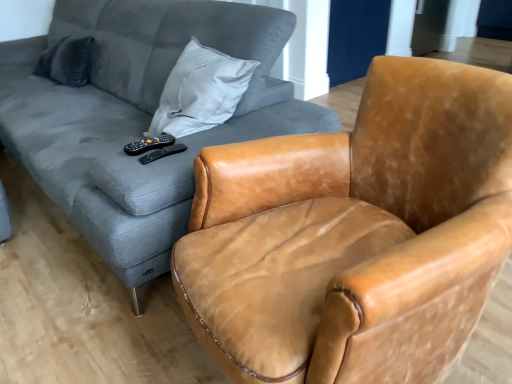
What is the approximate width of black matte remote at center, the 2th remote when ordered from left to right?

It is 13.40 centimeters.

This screenshot has height=384, width=512. What do you see at coordinates (138, 117) in the screenshot?
I see `matte gray fabric couch at upper left` at bounding box center [138, 117].

Describe the element at coordinates (67, 61) in the screenshot. Image resolution: width=512 pixels, height=384 pixels. I see `dark gray fabric pillow at upper left` at that location.

Where is `black matte remote at center, which is the 1th remote from right to left`? This screenshot has width=512, height=384. black matte remote at center, which is the 1th remote from right to left is located at coordinates (163, 153).

Based on their sizes in the image, would you say black matte remote at center, which is the 1th remote from right to left, is bigger or smaller than matte gray fabric couch at upper left?

Clearly, black matte remote at center, which is the 1th remote from right to left, is smaller in size than matte gray fabric couch at upper left.

Which of these two, black matte remote at center, the 2th remote when ordered from left to right, or matte gray fabric couch at upper left, is wider?

Wider between the two is matte gray fabric couch at upper left.

Can you confirm if black matte remote at center, which is the 1th remote from right to left, is positioned to the left of matte gray fabric couch at upper left?

Incorrect, black matte remote at center, which is the 1th remote from right to left, is not on the left side of matte gray fabric couch at upper left.

Which point is more forward, (x=178, y=148) or (x=176, y=17)?

The point (x=178, y=148) is in front.

Could you measure the distance between dark gray fabric pillow at upper left and black matte remote at center, the 2th remote when ordered from left to right?

1.58 meters.

Where is `pillow above the black matte remote at center, the 2th remote when ordered from left to right (from the image's perspective)`? pillow above the black matte remote at center, the 2th remote when ordered from left to right (from the image's perspective) is located at coordinates coord(67,61).

Is dark gray fabric pillow at upper left with black matte remote at center, which is the 1th remote from right to left?

No, dark gray fabric pillow at upper left is not next to black matte remote at center, which is the 1th remote from right to left.

Who is taller, dark gray fabric pillow at upper left or black matte remote at center, which is the 1th remote from right to left?

dark gray fabric pillow at upper left is taller.

Is leather armchair at center wider or thinner than black matte remote at center, the 2th remote when ordered from left to right?

Answer: In the image, leather armchair at center appears to be wider than black matte remote at center, the 2th remote when ordered from left to right.

Can you confirm if leather armchair at center is bigger than black matte remote at center, which is the 1th remote from right to left?

Correct, leather armchair at center is larger in size than black matte remote at center, which is the 1th remote from right to left.

Is leather armchair at center facing towards black matte remote at center, the 2th remote when ordered from left to right?

No, leather armchair at center is not turned towards black matte remote at center, the 2th remote when ordered from left to right.

From the image's perspective, which object appears higher, leather armchair at center or black matte remote at center, the 2th remote when ordered from left to right?

black matte remote at center, the 2th remote when ordered from left to right, from the image's perspective.

Between leather armchair at center and dark gray fabric pillow at upper left, which one has larger size?

With larger size is leather armchair at center.

Considering the sizes of objects leather armchair at center and dark gray fabric pillow at upper left in the image provided, who is thinner, leather armchair at center or dark gray fabric pillow at upper left?

With smaller width is dark gray fabric pillow at upper left.

Is leather armchair at center taller or shorter than dark gray fabric pillow at upper left?

Clearly, leather armchair at center is taller compared to dark gray fabric pillow at upper left.

Is dark gray fabric pillow at upper left surrounded by leather armchair at center?

That's incorrect, dark gray fabric pillow at upper left is not inside leather armchair at center.

Is matte gray fabric couch at upper left surrounded by dark gray fabric pillow at upper left?

No, dark gray fabric pillow at upper left does not contain matte gray fabric couch at upper left.

Based on their sizes in the image, would you say dark gray fabric pillow at upper left is bigger or smaller than matte gray fabric couch at upper left?

dark gray fabric pillow at upper left is smaller than matte gray fabric couch at upper left.

You are a GUI agent. You are given a task and a screenshot of the screen. Output one action in this format:
    pyautogui.click(x=<x>, y=<y>)
    Task: Click on the studio couch below the dark gray fabric pillow at upper left (from the image's perspective)
    
    Given the screenshot: What is the action you would take?
    pyautogui.click(x=138, y=117)

Based on their sizes in the image, would you say matte gray fabric couch at upper left is bigger or smaller than dark gray fabric pillow at upper left?

matte gray fabric couch at upper left is bigger than dark gray fabric pillow at upper left.

Considering the relative sizes of matte gray fabric couch at upper left and dark gray fabric pillow at upper left in the image provided, is matte gray fabric couch at upper left wider than dark gray fabric pillow at upper left?

Yes, matte gray fabric couch at upper left is wider than dark gray fabric pillow at upper left.

Measure the distance from matte gray fabric couch at upper left to dark gray fabric pillow at upper left.

The distance of matte gray fabric couch at upper left from dark gray fabric pillow at upper left is 24.37 inches.

The image size is (512, 384). In the image, there is a dark gray fabric pillow at upper left. Find the location of `studio couch below it (from the image's perspective)`. studio couch below it (from the image's perspective) is located at coordinates (138, 117).

Is leather armchair at center at the back of matte gray fabric couch at upper left?

No.

From the picture: Considering the positions of objects matte gray fabric couch at upper left and leather armchair at center in the image provided, who is more to the right, matte gray fabric couch at upper left or leather armchair at center?

Positioned to the right is leather armchair at center.

Does point (261, 75) lie in front of point (366, 184)?

No, it is not.

From the picture: From the image's perspective, which one is positioned higher, matte gray fabric couch at upper left or leather armchair at center?

From the image's view, matte gray fabric couch at upper left is above.

Where is `the 2nd remote counting from the right of the matte gray fabric couch at upper left`? The height and width of the screenshot is (384, 512). the 2nd remote counting from the right of the matte gray fabric couch at upper left is located at coordinates (163, 153).

In the image, there is a black matte remote at center, the 2th remote when ordered from left to right. What are the coordinates of `pillow above it (from the image's perspective)` in the screenshot? It's located at (67, 61).

When comparing their distances from black plastic remote at center, which is the second remote from right to left, does leather armchair at center or matte gray fabric couch at upper left seem further?

Among the two, matte gray fabric couch at upper left is located further to black plastic remote at center, which is the second remote from right to left.

Which object lies further to the anchor point black matte remote at center, which is the 1th remote from right to left, matte gray fabric couch at upper left or dark gray fabric pillow at upper left?

dark gray fabric pillow at upper left lies further to black matte remote at center, which is the 1th remote from right to left, than the other object.

Which object lies further to the anchor point matte gray fabric couch at upper left, dark gray fabric pillow at upper left or black plastic remote at center, marked as the 1th remote in a left-to-right arrangement?

black plastic remote at center, marked as the 1th remote in a left-to-right arrangement, is positioned further to the anchor matte gray fabric couch at upper left.

In the scene shown: Considering their positions, is black plastic remote at center, which is the second remote from right to left, positioned closer to matte gray fabric couch at upper left than leather armchair at center?

leather armchair at center lies closer to matte gray fabric couch at upper left than the other object.

Looking at the image, which one is located closer to dark gray fabric pillow at upper left, matte gray fabric couch at upper left or black matte remote at center, the 2th remote when ordered from left to right?

matte gray fabric couch at upper left is closer to dark gray fabric pillow at upper left.

Looking at the image, which one is located closer to leather armchair at center, dark gray fabric pillow at upper left or black matte remote at center, which is the 1th remote from right to left?

The object closer to leather armchair at center is black matte remote at center, which is the 1th remote from right to left.

Based on their spatial positions, is black matte remote at center, the 2th remote when ordered from left to right, or dark gray fabric pillow at upper left closer to matte gray fabric couch at upper left?

Based on the image, dark gray fabric pillow at upper left appears to be nearer to matte gray fabric couch at upper left.

Which object lies further to the anchor point leather armchair at center, black matte remote at center, which is the 1th remote from right to left, or black plastic remote at center, marked as the 1th remote in a left-to-right arrangement?

black plastic remote at center, marked as the 1th remote in a left-to-right arrangement, is further to leather armchair at center.

Locate an element on the screen. This screenshot has height=384, width=512. remote between leather armchair at center and black plastic remote at center, marked as the 1th remote in a left-to-right arrangement, from front to back is located at coordinates (163, 153).

Locate an element on the screen. Image resolution: width=512 pixels, height=384 pixels. remote between black matte remote at center, the 2th remote when ordered from left to right, and dark gray fabric pillow at upper left in the front-back direction is located at coordinates (149, 144).

The width and height of the screenshot is (512, 384). I want to click on remote located between matte gray fabric couch at upper left and black plastic remote at center, marked as the 1th remote in a left-to-right arrangement, in the depth direction, so click(x=163, y=153).

Where is `studio couch located between leather armchair at center and dark gray fabric pillow at upper left in the depth direction`? studio couch located between leather armchair at center and dark gray fabric pillow at upper left in the depth direction is located at coordinates (138, 117).